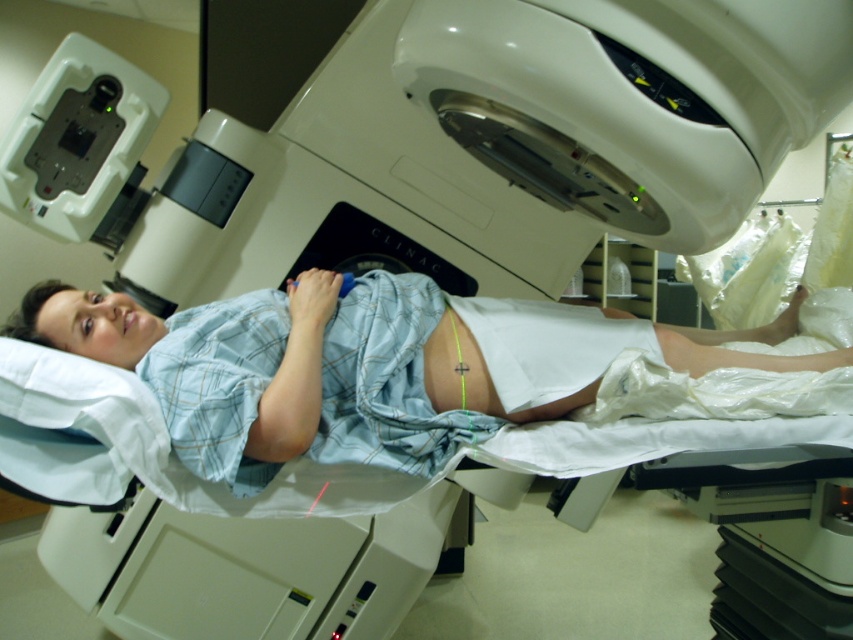
Which is behind, point (315, 397) or point (102, 84)?

Point (102, 84)

Is light blue plaid shirt at center positioned in front of white plastic device at upper left?

Yes, it is in front of white plastic device at upper left.

This screenshot has height=640, width=853. I want to click on light blue plaid shirt at center, so click(x=357, y=365).

Does point (223, 448) come farther from viewer compared to point (479, 404)?

No, (223, 448) is closer to viewer.

Is point (604, 344) in front of point (479, 378)?

That is False.

Does point (194, 433) come in front of point (454, 349)?

Yes, it is.

At what (x,y) coordinates should I click in order to perform the action: click on light blue plaid shirt at center. Please return your answer as a coordinate pair (x, y). Image resolution: width=853 pixels, height=640 pixels. Looking at the image, I should click on (357, 365).

Who is more distant from viewer, (96,218) or (454,321)?

The point (96,218) is behind.

What do you see at coordinates (80, 145) in the screenshot? I see `white plastic device at upper left` at bounding box center [80, 145].

Find the location of a particular element. The image size is (853, 640). white plastic device at upper left is located at coordinates (80, 145).